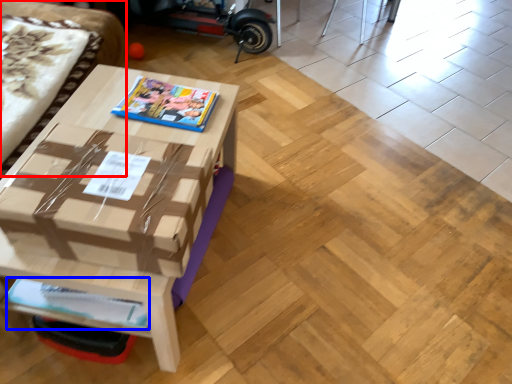
Question: Which of the following is the farthest to the observer, couch (highlighted by a red box) or magazine (highlighted by a blue box)?

Choices:
 (A) couch
 (B) magazine

Answer: (B)